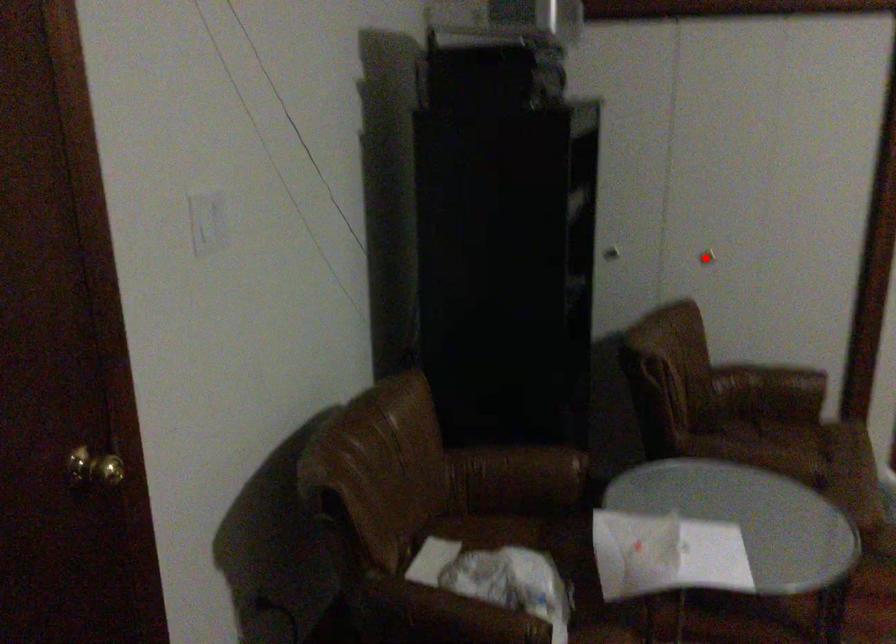
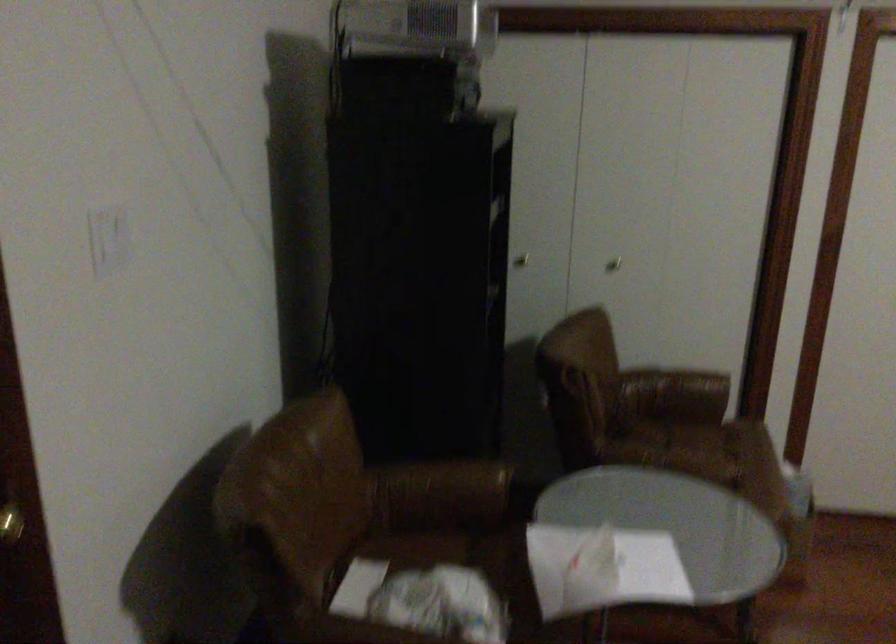
The point at the highlighted location is marked in the first image. Where is the corresponding point in the second image?

(613, 263)